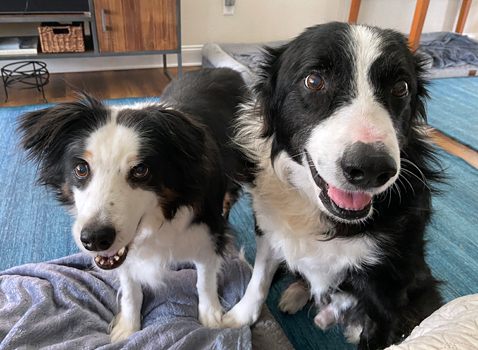
Find the location of a particular element. cabinet door is located at coordinates (143, 38).